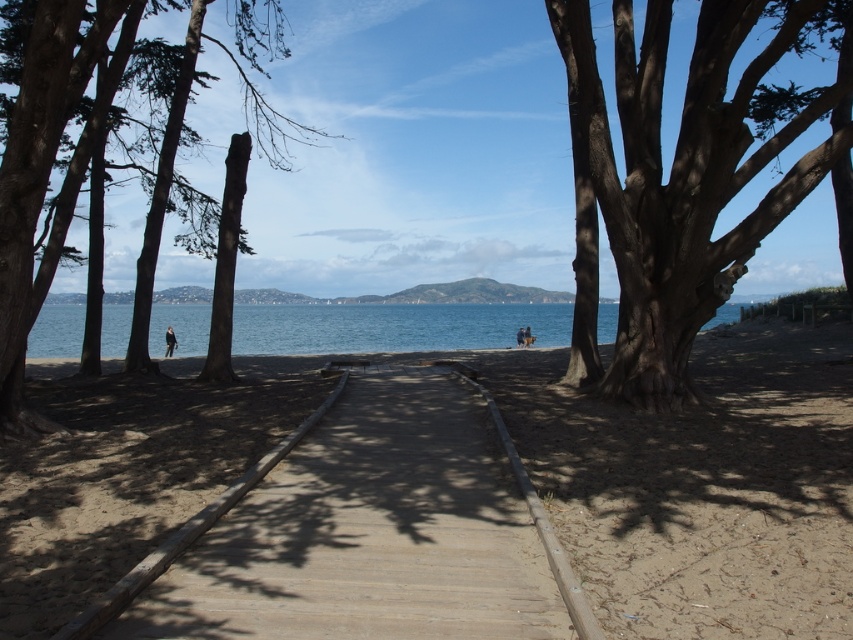
You are a photographer standing on the beach and want to capture both the smooth brown tree trunk at left and the blue water at center in your shot. Which object will appear larger in your photo?

The smooth brown tree trunk at left will appear larger in the photo because it is much taller than the blue water at center.

You are standing at the center of the wooden boardwalk pathway in the beach scene. You want to walk towards the smooth brown tree trunk at right located at point (676, 180). Is the direction you should walk towards the left or right side of the boardwalk pathway?

The smooth brown tree trunk at right is located at point (676, 180), which is to the right side of the boardwalk pathway. Therefore, you should walk towards the right side of the boardwalk pathway to reach it.

You are standing on the wooden boardwalk pathway and want to walk towards the smooth brown tree trunk at right and the smooth brown tree trunk at left. Which tree trunk will you reach first?

You will reach the smooth brown tree trunk at right first because it is closer to you than the smooth brown tree trunk at left, which is further away.